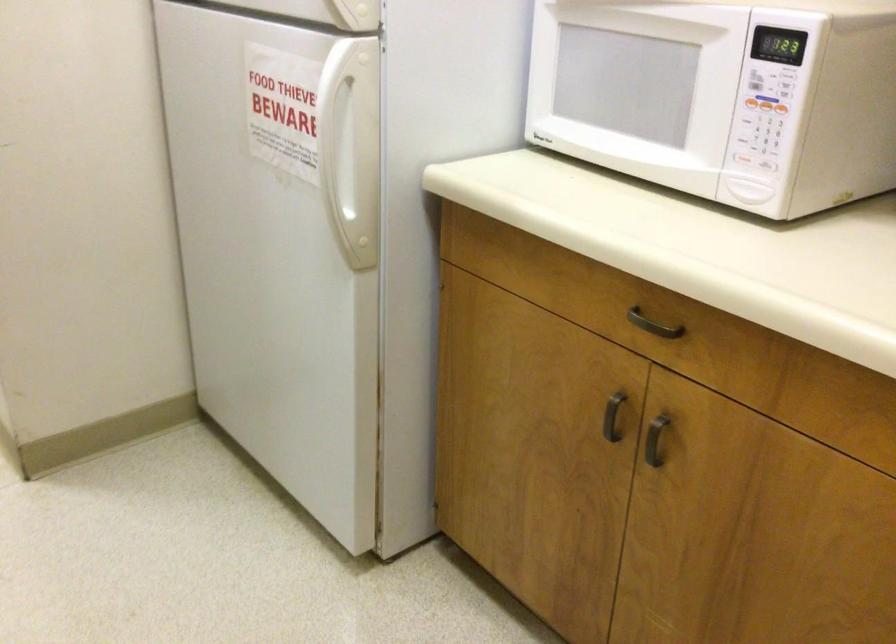
This screenshot has width=896, height=644. Find the location of `white refrigerator handle`. white refrigerator handle is located at coordinates (350, 146).